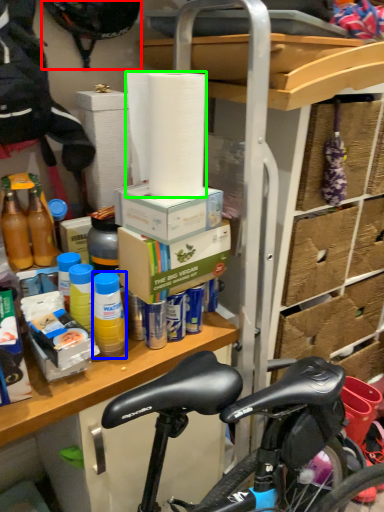
Question: Based on their relative distances, which object is nearer to bicycle helmet (highlighted by a red box)? Choose from bottle (highlighted by a blue box) and paper towel (highlighted by a green box).

Choices:
 (A) bottle
 (B) paper towel

Answer: (B)